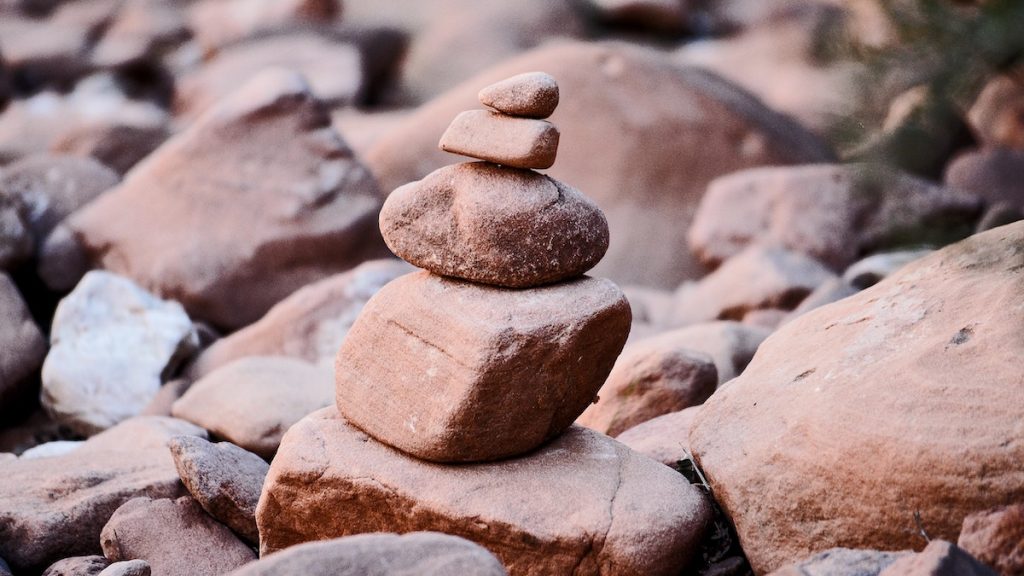
This screenshot has width=1024, height=576. In order to click on plant in this screenshot , I will do `click(941, 59)`.